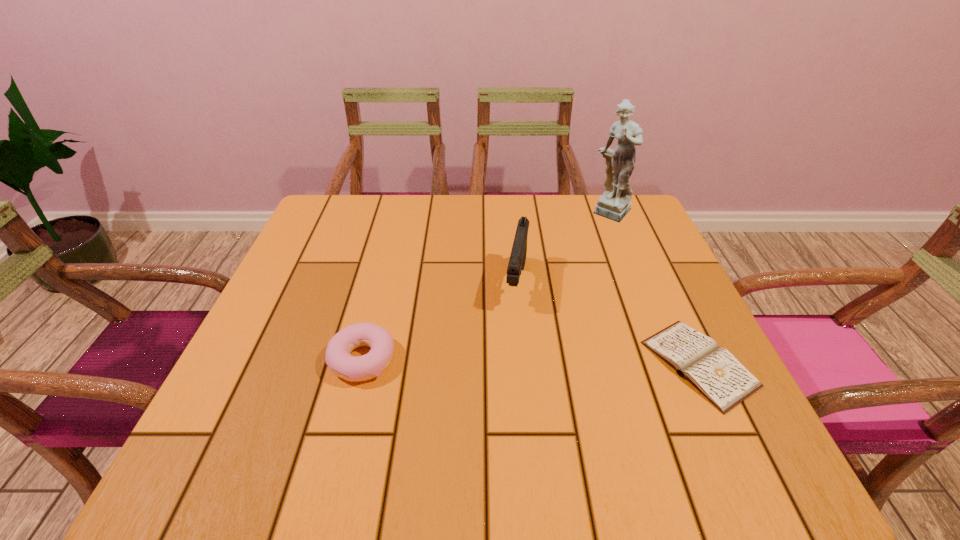
This screenshot has width=960, height=540. In order to click on vacant space on the desktop that is between the doughnut and the shortest object and is positioned at the barrel of the second object from left to right in this screenshot , I will do `click(500, 362)`.

Locate an element on the screen. vacant spot on the desktop that is between the doughnut and the diary and is positioned on the front-facing side of the farthest object is located at coordinates 500,362.